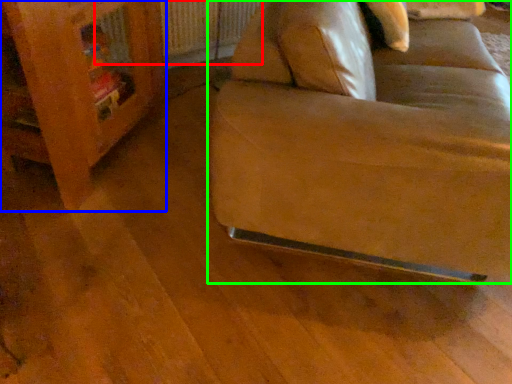
Question: Estimate the real-world distances between objects in this image. Which object is farther from radiator (highlighted by a red box), furniture (highlighted by a blue box) or studio couch (highlighted by a green box)?

Choices:
 (A) furniture
 (B) studio couch

Answer: (B)